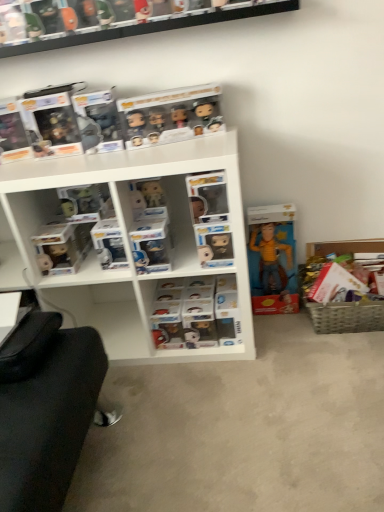
Question: Considering their positions, is clear plastic figures at center located in front of or behind woven basket at lower right?

Choices:
 (A) front
 (B) behind

Answer: (B)

Question: From the image's perspective, is clear plastic figures at center located above or below woven basket at lower right?

Choices:
 (A) below
 (B) above

Answer: (A)

Question: Based on their relative distances, which object is nearer to the clear plastic figures at center?

Choices:
 (A) woven basket at lower right
 (B) matte black figurine at left, positioned as the 2th toy in right-to-left order
 (C) white plastic shelf at center, the second shelf in the top-to-bottom sequence
 (D) yellow fabric doll at center, the first toy positioned from the right
 (E) clear plastic figurines at upper center, which is the 1th shelf from top to bottom

Answer: (C)

Question: Which object is the farthest from the yellow fabric doll at center, which appears as the 2th toy when viewed from the left?

Choices:
 (A) matte black figurine at left, which is the 1th toy from left to right
 (B) clear plastic figurines at upper center, the 2th shelf positioned from the bottom
 (C) white plastic shelf at center, the second shelf in the top-to-bottom sequence
 (D) clear plastic figures at center
 (E) woven basket at lower right

Answer: (B)